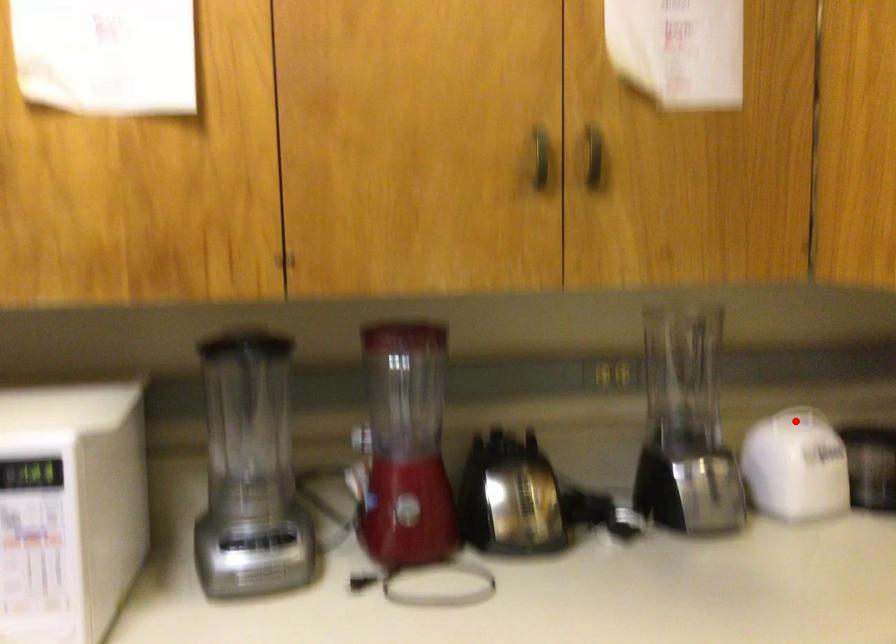
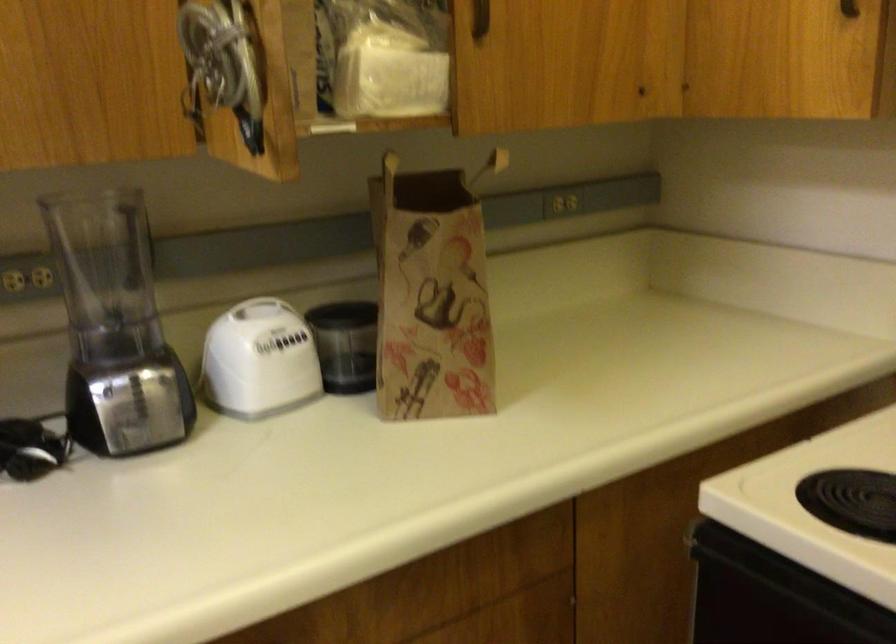
In the second image, find the point that corresponds to the highlighted location in the first image.

(260, 308)